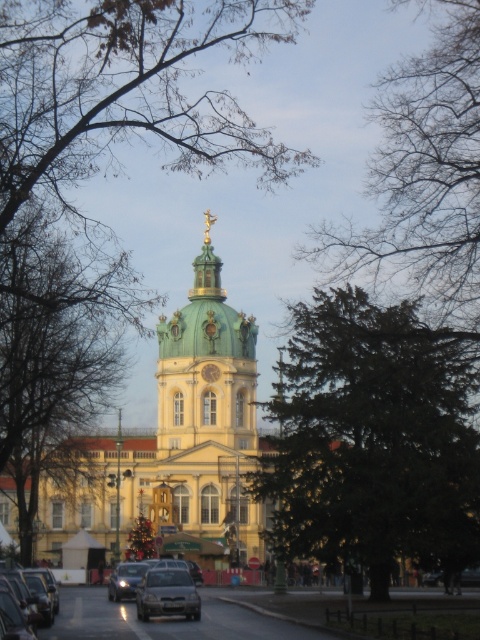
You are a photographer planning to capture the green matte dome at center and the matte silver sedan at center in a single frame. Based on the scene described, which object should you position closer to the center of your camera frame to ensure both are fully visible?

The green matte dome at center has a greater width than the matte silver sedan at center, so positioning the dome closer to the center of the camera frame would allow both objects to be fully visible while accommodating their size difference.

You are a painter standing in front of the grand building with a golden dome. You notice a green textured tree at center and a gold metallic clock at center. Which object is wider when viewed from your current position?

The green textured tree at center is wider than the gold metallic clock at center.